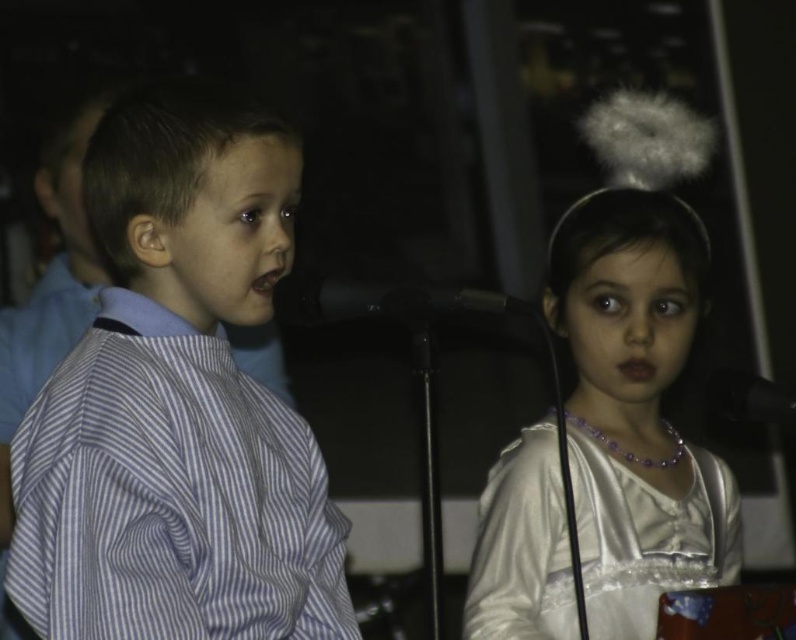
You are a stagehand setting up a new microphone stand between the blue striped shirt at left and the silvery satin dress at center. The stand requires at least 1 meter of space between the two to fit properly. Based on their widths, can the microphone stand be placed between them?

The blue striped shirt at left has a lesser width compared to silvery satin dress at center. Since the total width of both objects is not provided, it is impossible to determine if there is enough space for the microphone stand between them.

You are a photographer setting up for a school play. You need to position a spotlight so it shines equally on both the blue striped shirt at left and the silvery satin dress at center. Based on their positions, where should you aim the spotlight?

You should aim the spotlight between the blue striped shirt at left and the silvery satin dress at center since the blue striped shirt at left is to the left of silvery satin dress at center, so the midpoint between them would ensure equal illumination.